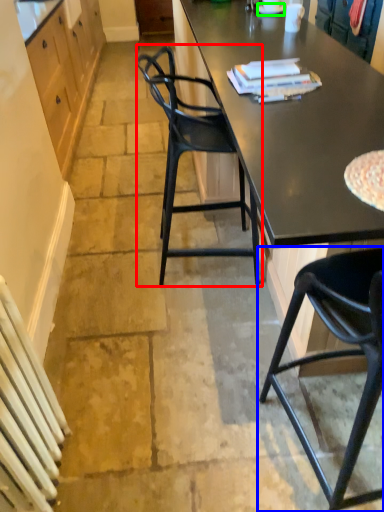
Question: Which object is the closest to the chair (highlighted by a red box)? Choose among these: chair (highlighted by a blue box) or plate (highlighted by a green box).

Choices:
 (A) chair
 (B) plate

Answer: (A)